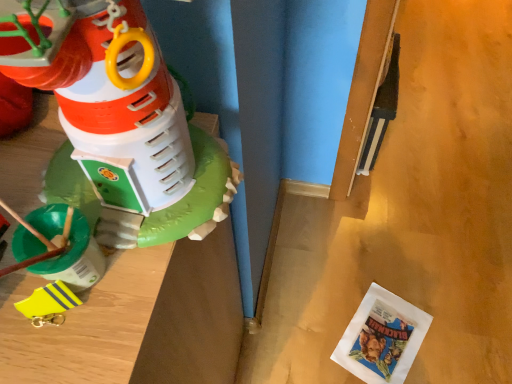
Find the location of `free area behind white paper comic book at lower right`. free area behind white paper comic book at lower right is located at coordinates (x=366, y=269).